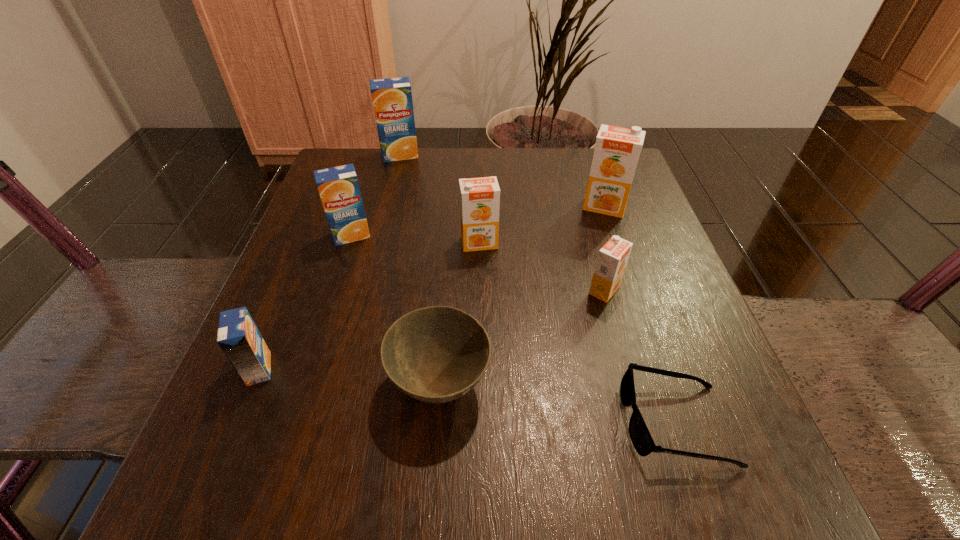
This screenshot has width=960, height=540. Identify the location of free space at the left edge. click(x=220, y=445).

In order to click on vacant region at the right edge of the desktop in this screenshot , I will do pos(635,360).

In the image, there is a desktop. What are the coordinates of `vacant region at the far right corner` in the screenshot? It's located at (591, 161).

Find the location of a particular element. The width and height of the screenshot is (960, 540). vacant space at the near right corner of the desktop is located at coordinates pyautogui.click(x=761, y=504).

I want to click on empty location between the fifth farthest orange juice and the farthest object, so click(502, 222).

Locate an element on the screen. Image resolution: width=960 pixels, height=540 pixels. free spot between the shortest object and the fourth orange juice from left to right is located at coordinates (577, 333).

The image size is (960, 540). What are the coordinates of `free space between the nearest blue orange_juice and the shortest object` in the screenshot? It's located at (467, 396).

This screenshot has height=540, width=960. I want to click on vacant space in between the second nearest blue orange_juice and the seventh tallest object, so click(396, 309).

The image size is (960, 540). I want to click on free space between the fourth orange juice from left to right and the second farthest blue orange_juice, so click(x=415, y=239).

Identify the location of blank region between the farthest blue orange_juice and the biggest orange orange juice. The image size is (960, 540). (502, 180).